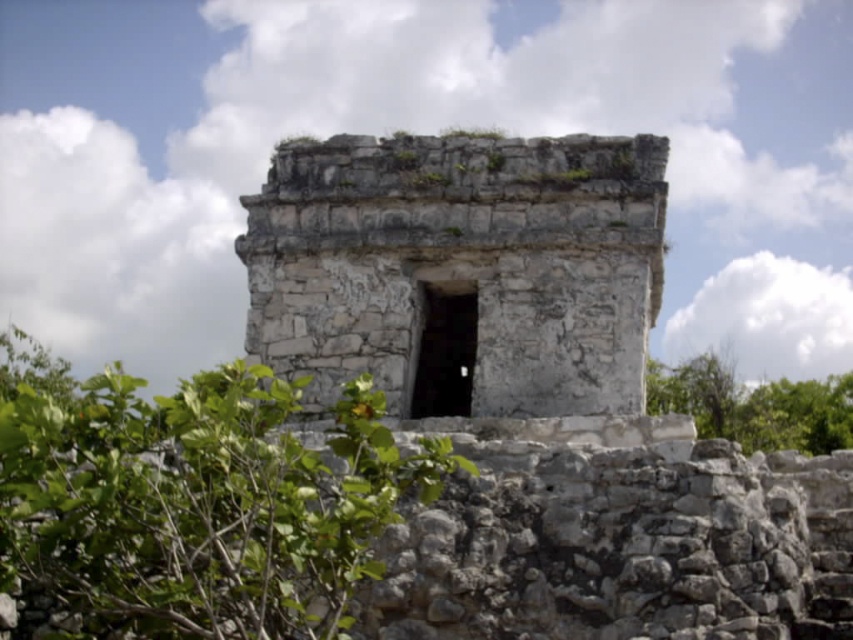
You are standing in front of the ancient stone structure and want to walk from the point at coordinate (399, 147) to the point at coordinate (753, 419). Which direction should you move relative to the structure?

You should move towards the back of the ancient stone structure because point (399, 147) is in front of point (753, 419).

You are an archaeologist examining the ancient stone structure. You notice the white stone ruins at center and the green leafy bush at center. Which object is larger in size?

The white stone ruins at center has a smaller size compared to green leafy bush at center, so the green leafy bush at center is larger in size.